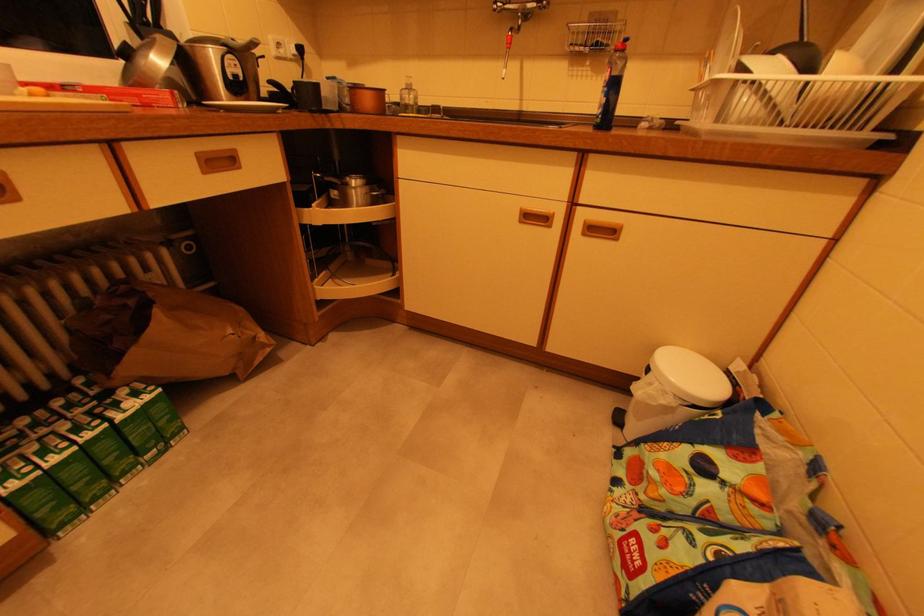
At what (x,y) coordinates should I click in order to perform the action: click on pot handle. Please return your answer as a coordinate pair (x, y). This screenshot has height=616, width=924. Looking at the image, I should click on (242, 45).